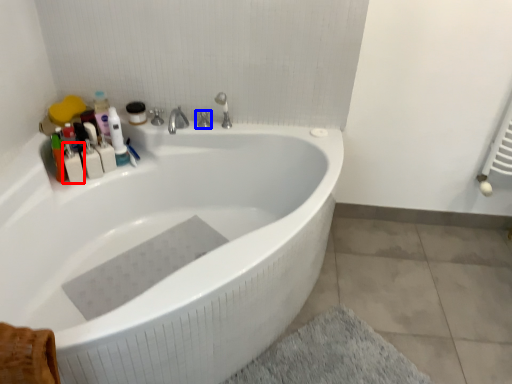
Question: Which object appears farthest to the camera in this image, toiletry (highlighted by a red box) or tap (highlighted by a blue box)?

Choices:
 (A) toiletry
 (B) tap

Answer: (B)